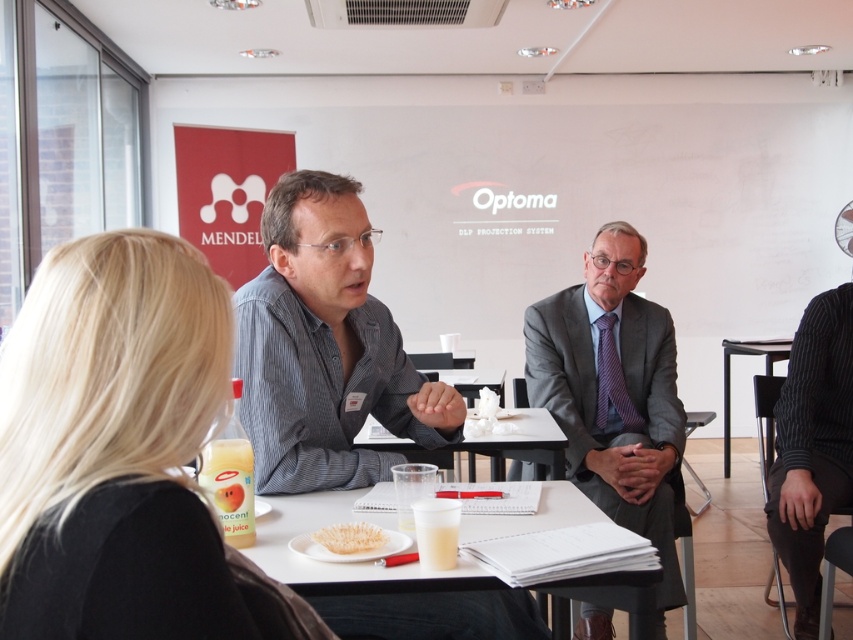
Question: Which point is farther from the camera taking this photo?

Choices:
 (A) (554, 515)
 (B) (616, 500)

Answer: (B)

Question: Can you confirm if black ribbed sweater at lower right is bigger than white plastic table at center?

Choices:
 (A) yes
 (B) no

Answer: (B)

Question: Which of the following is the farthest from the observer?

Choices:
 (A) white plastic table at center
 (B) black ribbed sweater at lower right
 (C) black plastic table at lower right

Answer: (C)

Question: Is the position of gray suit at center less distant than that of white paper at center?

Choices:
 (A) yes
 (B) no

Answer: (B)

Question: Does gray striped shirt at center come in front of white paper at center?

Choices:
 (A) no
 (B) yes

Answer: (A)

Question: Estimate the real-world distances between objects in this image. Which object is farther from the black plastic table at lower right?

Choices:
 (A) gray striped shirt at center
 (B) blonde hair at upper left

Answer: (B)